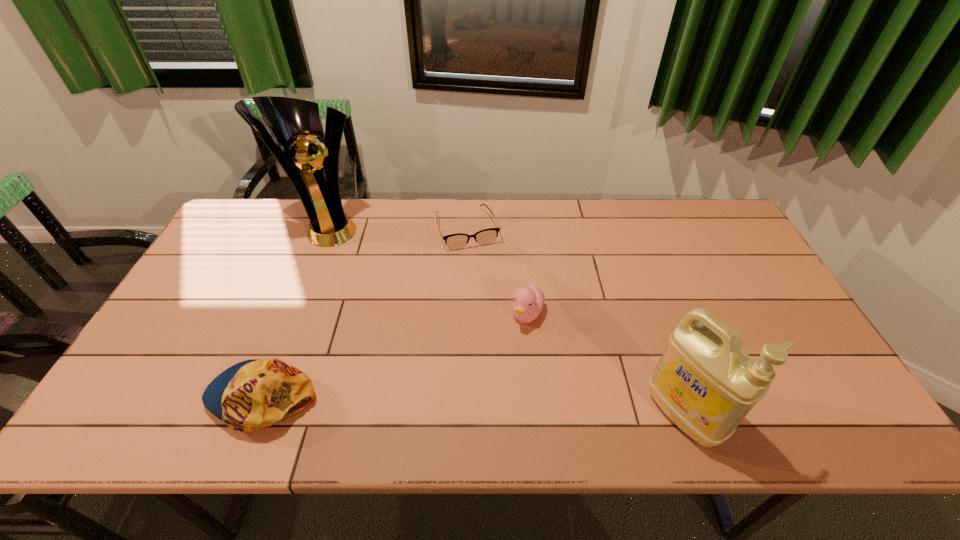
Find the location of a particular element. Image resolution: width=960 pixels, height=540 pixels. cap is located at coordinates (254, 394).

Find the location of a particular element. the rightmost object is located at coordinates (705, 382).

Find the location of a particular element. This screenshot has width=960, height=540. detergent is located at coordinates (705, 382).

Locate an element on the screen. This screenshot has width=960, height=540. the tallest object is located at coordinates (294, 123).

Image resolution: width=960 pixels, height=540 pixels. I want to click on the third farthest object, so click(x=528, y=302).

Image resolution: width=960 pixels, height=540 pixels. Find the location of `the second object from right to left`. the second object from right to left is located at coordinates (528, 302).

This screenshot has height=540, width=960. What are the coordinates of `the third object from right to left` in the screenshot? It's located at (457, 241).

Image resolution: width=960 pixels, height=540 pixels. Identify the location of the shortest object. [x=457, y=241].

Where is `blank space located 0.150m on the bill of the cap`? Image resolution: width=960 pixels, height=540 pixels. blank space located 0.150m on the bill of the cap is located at coordinates (143, 396).

Identify the location of vacant space located 0.210m on the bill of the cap. The height and width of the screenshot is (540, 960). (118, 396).